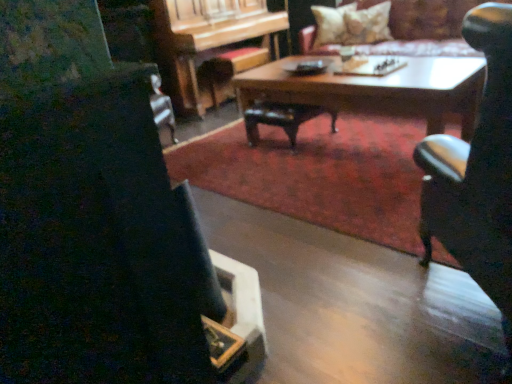
Locate an element on the screen. The image size is (512, 384). soft beige pillow at upper center, which is the first pillow from left to right is located at coordinates (x=330, y=24).

In order to click on wooden coffee table at center in this screenshot , I will do `click(378, 90)`.

This screenshot has height=384, width=512. What do you see at coordinates (477, 171) in the screenshot?
I see `black leather chair at right` at bounding box center [477, 171].

Describe the element at coordinates (367, 25) in the screenshot. The height and width of the screenshot is (384, 512). I see `fluffy beige pillow at upper right, placed as the 2th pillow when sorted from left to right` at that location.

Locate an element on the screen. The width and height of the screenshot is (512, 384). soft beige pillow at upper center, which appears as the 2th pillow when viewed from the right is located at coordinates (330, 24).

Is there a large distance between black leather chair at right and wooden coffee table at center?

Indeed, black leather chair at right is not near wooden coffee table at center.

Can you confirm if black leather chair at right is positioned to the left of wooden coffee table at center?

Incorrect, black leather chair at right is not on the left side of wooden coffee table at center.

Is point (490, 116) closer to viewer compared to point (464, 84)?

That is True.

From the image's perspective, which one is positioned lower, black leather chair at right or wooden coffee table at center?

From the image's view, black leather chair at right is below.

From the image's perspective, is wooden coffee table at center located above or below fluffy beige pillow at upper right, placed as the first pillow when sorted from right to left?

wooden coffee table at center is below fluffy beige pillow at upper right, placed as the first pillow when sorted from right to left.

Is wooden coffee table at center at the left side of fluffy beige pillow at upper right, placed as the first pillow when sorted from right to left?

Yes, wooden coffee table at center is to the left of fluffy beige pillow at upper right, placed as the first pillow when sorted from right to left.

In the scene shown: From a real-world perspective, who is located lower, wooden coffee table at center or fluffy beige pillow at upper right, placed as the 2th pillow when sorted from left to right?

wooden coffee table at center is physically lower.

Is wooden coffee table at center thinner than fluffy beige pillow at upper right, placed as the first pillow when sorted from right to left?

Incorrect, the width of wooden coffee table at center is not less than that of fluffy beige pillow at upper right, placed as the first pillow when sorted from right to left.

This screenshot has width=512, height=384. What are the coordinates of `piano that is under the fluffy beige pillow at upper right, placed as the 2th pillow when sorted from left to right (from a real-world perspective)` in the screenshot? It's located at (206, 38).

From a real-world perspective, between wooden piano at center and fluffy beige pillow at upper right, placed as the 2th pillow when sorted from left to right, who is vertically lower?

wooden piano at center is physically lower.

Is wooden piano at center bigger or smaller than fluffy beige pillow at upper right, placed as the 2th pillow when sorted from left to right?

wooden piano at center is bigger than fluffy beige pillow at upper right, placed as the 2th pillow when sorted from left to right.

How much distance is there between soft beige pillow at upper center, which appears as the 2th pillow when viewed from the right, and velvet beige couch at upper center?

soft beige pillow at upper center, which appears as the 2th pillow when viewed from the right, is 23.15 inches away from velvet beige couch at upper center.

What are the coordinates of `couch below the soft beige pillow at upper center, which is the first pillow from left to right (from a real-world perspective)` in the screenshot? It's located at (426, 28).

Is soft beige pillow at upper center, which is the first pillow from left to right, facing away from velvet beige couch at upper center?

Absolutely, soft beige pillow at upper center, which is the first pillow from left to right, is directed away from velvet beige couch at upper center.

Who is taller, wooden coffee table at center or wooden piano at center?

wooden piano at center.

Consider the image. From a real-world perspective, is wooden coffee table at center under wooden piano at center?

Indeed, from a real-world perspective, wooden coffee table at center is positioned beneath wooden piano at center.

Where is `coffee table in front of the wooden piano at center`? This screenshot has width=512, height=384. coffee table in front of the wooden piano at center is located at coordinates (378, 90).

Can you tell me how much wooden coffee table at center and wooden piano at center differ in facing direction?

wooden coffee table at center and wooden piano at center are facing 88.2 degrees away from each other.

From the image's perspective, is wooden piano at center below wooden coffee table at center?

Incorrect, from the image's perspective, wooden piano at center is higher than wooden coffee table at center.

You are a GUI agent. You are given a task and a screenshot of the screen. Output one action in this format:
    pyautogui.click(x=<x>, y=<y>)
    Task: Click on the coffee table that appears in front of the wooden piano at center
    Image resolution: width=512 pixels, height=384 pixels.
    Given the screenshot: What is the action you would take?
    (x=378, y=90)

Is fluffy beige pillow at upper right, placed as the 2th pillow when sorted from left to right, outside of black leather chair at right?

fluffy beige pillow at upper right, placed as the 2th pillow when sorted from left to right, is positioned outside black leather chair at right.

Considering the relative sizes of fluffy beige pillow at upper right, placed as the 2th pillow when sorted from left to right, and black leather chair at right in the image provided, is fluffy beige pillow at upper right, placed as the 2th pillow when sorted from left to right, taller than black leather chair at right?

No, fluffy beige pillow at upper right, placed as the 2th pillow when sorted from left to right, is not taller than black leather chair at right.

Is there a large distance between fluffy beige pillow at upper right, placed as the first pillow when sorted from right to left, and black leather chair at right?

Yes, fluffy beige pillow at upper right, placed as the first pillow when sorted from right to left, and black leather chair at right are quite far apart.

From a real-world perspective, which is physically below, fluffy beige pillow at upper right, placed as the first pillow when sorted from right to left, or black leather chair at right?

From a 3D spatial view, black leather chair at right is below.

I want to click on coffee table that appears on the left of black leather chair at right, so click(378, 90).

Identify the location of pillow that is the 2nd object to the right of the wooden coffee table at center, starting at the anchor. This screenshot has width=512, height=384. (367, 25).

Considering their positions, is wooden piano at center positioned further to fluffy beige pillow at upper right, placed as the 2th pillow when sorted from left to right, than black leather chair at right?

The object further to fluffy beige pillow at upper right, placed as the 2th pillow when sorted from left to right, is black leather chair at right.

Based on their spatial positions, is black leather chair at right or wooden piano at center further from soft beige pillow at upper center, which is the first pillow from left to right?

The object further to soft beige pillow at upper center, which is the first pillow from left to right, is black leather chair at right.

Based on their spatial positions, is velvet beige couch at upper center or wooden coffee table at center further from wooden piano at center?

Based on the image, wooden coffee table at center appears to be further to wooden piano at center.

Which object lies further to the anchor point fluffy beige pillow at upper right, placed as the first pillow when sorted from right to left, velvet beige couch at upper center or wooden piano at center?

wooden piano at center.

Consider the image. Based on their spatial positions, is wooden piano at center or wooden coffee table at center closer to black leather chair at right?

A: wooden coffee table at center is positioned closer to the anchor black leather chair at right.

Based on their spatial positions, is black leather chair at right or fluffy beige pillow at upper right, placed as the first pillow when sorted from right to left, further from wooden coffee table at center?

Based on the image, fluffy beige pillow at upper right, placed as the first pillow when sorted from right to left, appears to be further to wooden coffee table at center.

When comparing their distances from black leather chair at right, does soft beige pillow at upper center, which appears as the 2th pillow when viewed from the right, or wooden coffee table at center seem further?

The object further to black leather chair at right is soft beige pillow at upper center, which appears as the 2th pillow when viewed from the right.

Which object lies further to the anchor point velvet beige couch at upper center, black leather chair at right or soft beige pillow at upper center, which appears as the 2th pillow when viewed from the right?

Among the two, black leather chair at right is located further to velvet beige couch at upper center.

Identify the location of piano between black leather chair at right and soft beige pillow at upper center, which is the first pillow from left to right, in the front-back direction. (206, 38).

This screenshot has width=512, height=384. What are the coordinates of `couch between wooden coffee table at center and fluffy beige pillow at upper right, placed as the first pillow when sorted from right to left, from front to back` in the screenshot? It's located at [x=426, y=28].

Identify the location of pillow positioned between wooden coffee table at center and soft beige pillow at upper center, which appears as the 2th pillow when viewed from the right, from near to far. The image size is (512, 384). (367, 25).

Locate an element on the screen. Image resolution: width=512 pixels, height=384 pixels. couch positioned between black leather chair at right and soft beige pillow at upper center, which appears as the 2th pillow when viewed from the right, from near to far is located at coordinates (426, 28).